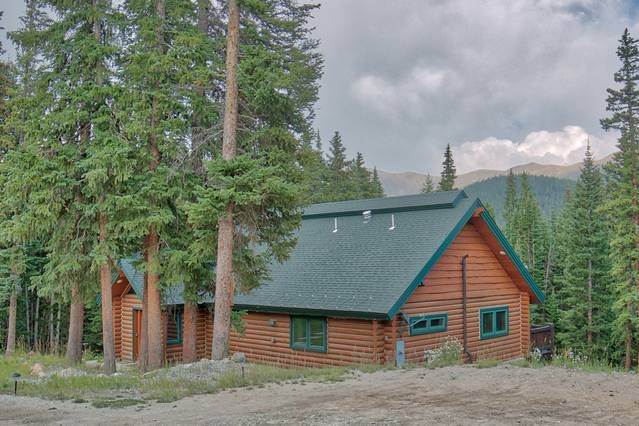
The width and height of the screenshot is (639, 426). Identify the location of door. (139, 319).